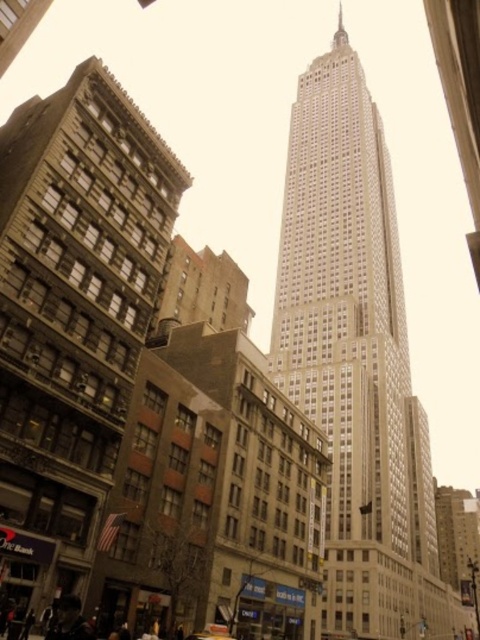
Between brown stone building at left and metallic silver car at center, which one is positioned lower?

metallic silver car at center is lower down.

Is brown stone building at left taller than metallic silver car at center?

Correct, brown stone building at left is much taller as metallic silver car at center.

Locate an element on the screen. The width and height of the screenshot is (480, 640). brown stone building at left is located at coordinates point(72,314).

Identify the location of brown stone building at left. (72, 314).

Between point (50, 301) and point (325, 161), which one is positioned in front?

Point (50, 301) is in front.

Looking at this image, is brown stone building at left to the left of beige stone tower at center from the viewer's perspective?

Indeed, brown stone building at left is positioned on the left side of beige stone tower at center.

Is point (59, 145) positioned after point (323, 152)?

That is False.

I want to click on brown stone building at left, so click(x=72, y=314).

Does beige stone tower at center have a lesser width compared to metallic silver car at center?

No, beige stone tower at center is not thinner than metallic silver car at center.

Is beige stone tower at center shorter than metallic silver car at center?

No.

The width and height of the screenshot is (480, 640). Find the location of `beige stone tower at center`. beige stone tower at center is located at coordinates pos(356,358).

The height and width of the screenshot is (640, 480). Find the location of `beige stone tower at center`. beige stone tower at center is located at coordinates (356, 358).